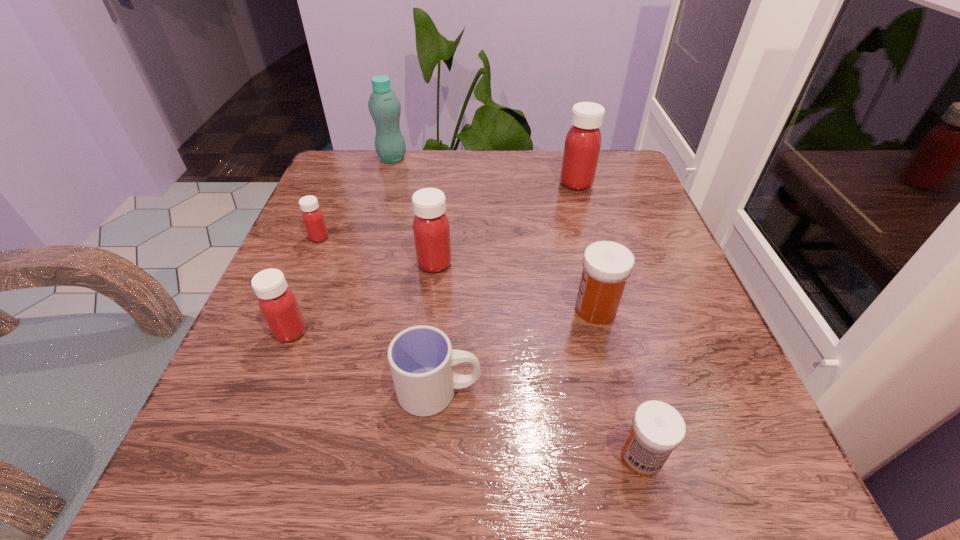
Where is `the sixth object from right to left`? Image resolution: width=960 pixels, height=540 pixels. the sixth object from right to left is located at coordinates (384, 106).

You are a GUI agent. You are given a task and a screenshot of the screen. Output one action in this format:
    pyautogui.click(x=<x>, y=<y>)
    Task: Click on the farthest object
    
    Given the screenshot: What is the action you would take?
    pyautogui.click(x=384, y=106)

Identify the location of the biggest red medicine. (583, 141).

The width and height of the screenshot is (960, 540). I want to click on the farthest red medicine, so click(x=583, y=141).

Identify the location of the second tallest medicine. The width and height of the screenshot is (960, 540). (431, 228).

Find the location of a particular element. The width and height of the screenshot is (960, 540). the third medicine from left to right is located at coordinates (431, 228).

This screenshot has height=540, width=960. What are the coordinates of `the bigger white medicine` in the screenshot? It's located at (606, 265).

This screenshot has width=960, height=540. I want to click on the nearest red medicine, so click(x=278, y=304).

Image resolution: width=960 pixels, height=540 pixels. What are the coordinates of `cup` in the screenshot? It's located at (421, 358).

The image size is (960, 540). What are the coordinates of `the third farthest object` in the screenshot? It's located at (312, 216).